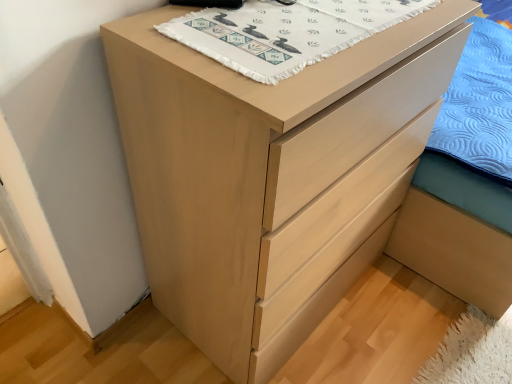
The height and width of the screenshot is (384, 512). Describe the element at coordinates (286, 32) in the screenshot. I see `white woven cloth at upper center` at that location.

Measure the distance between white woven cloth at upper center and camera.

The depth of white woven cloth at upper center is 71.77 centimeters.

Where is `white woven cloth at upper center`? white woven cloth at upper center is located at coordinates (286, 32).

What is the approximate height of light brown wood bed frame at lower right?

light brown wood bed frame at lower right is 34.02 inches in height.

Where is `light brown wood bed frame at lower right`? The height and width of the screenshot is (384, 512). light brown wood bed frame at lower right is located at coordinates (458, 234).

The image size is (512, 384). What do you see at coordinates (458, 234) in the screenshot? I see `light brown wood bed frame at lower right` at bounding box center [458, 234].

What are the coordinates of `white woven cloth at upper center` in the screenshot? It's located at (286, 32).

Between light brown wood bed frame at lower right and white woven cloth at upper center, which one appears on the right side from the viewer's perspective?

light brown wood bed frame at lower right.

Is light brown wood bed frame at lower right positioned before white woven cloth at upper center?

No, it is behind white woven cloth at upper center.

Considering the positions of point (456, 241) and point (346, 34), is point (456, 241) closer or farther from the camera than point (346, 34)?

Point (456, 241) is farther from the camera than point (346, 34).

From the image's perspective, relative to white woven cloth at upper center, is light brown wood bed frame at lower right above or below?

Clearly, from the image's perspective, light brown wood bed frame at lower right is above white woven cloth at upper center.

From a real-world perspective, which object stands above the other?

white woven cloth at upper center.

Is light brown wood bed frame at lower right wider than white woven cloth at upper center?

Yes, light brown wood bed frame at lower right is wider than white woven cloth at upper center.

Considering the relative sizes of light brown wood bed frame at lower right and white woven cloth at upper center in the image provided, is light brown wood bed frame at lower right shorter than white woven cloth at upper center?

No, light brown wood bed frame at lower right is not shorter than white woven cloth at upper center.

Considering the relative sizes of light brown wood bed frame at lower right and white woven cloth at upper center in the image provided, is light brown wood bed frame at lower right smaller than white woven cloth at upper center?

No, light brown wood bed frame at lower right is not smaller than white woven cloth at upper center.

In the scene shown: Is light brown wood bed frame at lower right not inside white woven cloth at upper center?

Yes, light brown wood bed frame at lower right is located beyond the bounds of white woven cloth at upper center.

Is light brown wood bed frame at lower right next to white woven cloth at upper center?

No, light brown wood bed frame at lower right is not with white woven cloth at upper center.

From the picture: Does light brown wood bed frame at lower right turn towards white woven cloth at upper center?

Yes, light brown wood bed frame at lower right is oriented towards white woven cloth at upper center.

The image size is (512, 384). Find the location of `bed frame beneath the white woven cloth at upper center (from a real-world perspective)`. bed frame beneath the white woven cloth at upper center (from a real-world perspective) is located at coordinates point(458,234).

Does white woven cloth at upper center appear on the left side of light brown wood bed frame at lower right?

Yes, white woven cloth at upper center is to the left of light brown wood bed frame at lower right.

Which object is further away from the camera, white woven cloth at upper center or light brown wood bed frame at lower right?

light brown wood bed frame at lower right is further away from the camera.

Does point (196, 50) appear closer or farther from the camera than point (413, 251)?

Point (196, 50).

From the image's perspective, is white woven cloth at upper center above light brown wood bed frame at lower right?

No.

From a real-world perspective, is white woven cloth at upper center physically below light brown wood bed frame at lower right?

No, from a real-world perspective, white woven cloth at upper center is not under light brown wood bed frame at lower right.

Is white woven cloth at upper center thinner than light brown wood bed frame at lower right?

Yes, white woven cloth at upper center is thinner than light brown wood bed frame at lower right.

Is white woven cloth at upper center shorter than light brown wood bed frame at lower right?

Correct, white woven cloth at upper center is not as tall as light brown wood bed frame at lower right.

Consider the image. Considering the sizes of objects white woven cloth at upper center and light brown wood bed frame at lower right in the image provided, who is bigger, white woven cloth at upper center or light brown wood bed frame at lower right?

light brown wood bed frame at lower right.

Is white woven cloth at upper center situated inside light brown wood bed frame at lower right or outside?

white woven cloth at upper center is not inside light brown wood bed frame at lower right, it's outside.

Is white woven cloth at upper center far from light brown wood bed frame at lower right?

No.

Is white woven cloth at upper center facing towards light brown wood bed frame at lower right?

No, white woven cloth at upper center is not aimed at light brown wood bed frame at lower right.

What's the angular difference between white woven cloth at upper center and light brown wood bed frame at lower right's facing directions?

The angular difference between white woven cloth at upper center and light brown wood bed frame at lower right is 87.1 degrees.

You are a GUI agent. You are given a task and a screenshot of the screen. Output one action in this format:
    pyautogui.click(x=<x>, y=<y>)
    Task: Click on the blanket above the light brown wood bed frame at lower right (from a real-world perspective)
    The image size is (512, 384).
    Given the screenshot: What is the action you would take?
    pyautogui.click(x=286, y=32)

The height and width of the screenshot is (384, 512). What are the coordinates of `bed frame that is on the right side of white woven cloth at upper center` in the screenshot? It's located at [x=458, y=234].

Where is `bed frame that appears behind the white woven cloth at upper center`? The width and height of the screenshot is (512, 384). bed frame that appears behind the white woven cloth at upper center is located at coordinates (458, 234).